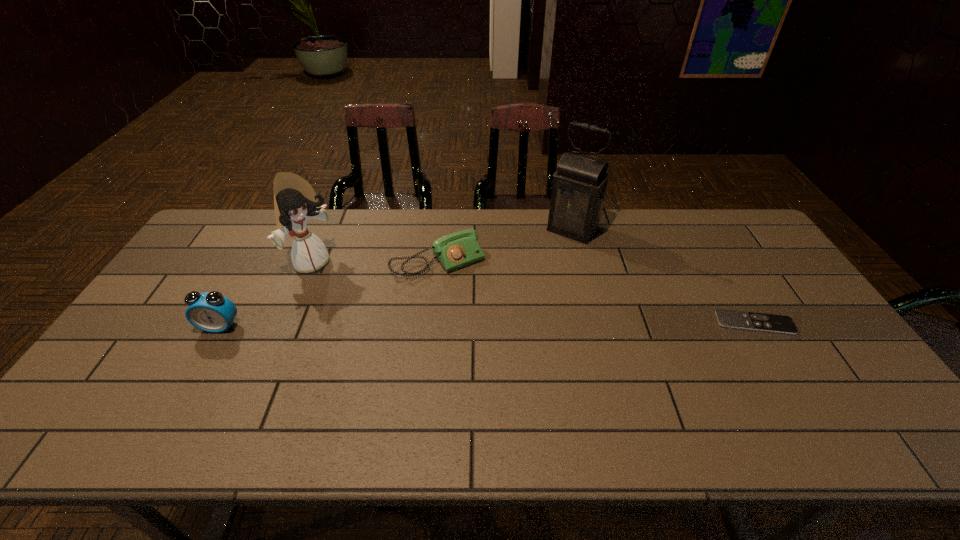
Where is `object that is the closest to the third shortest object`? object that is the closest to the third shortest object is located at coordinates (295, 201).

The height and width of the screenshot is (540, 960). I want to click on object that stands as the third closest to the lantern, so click(295, 201).